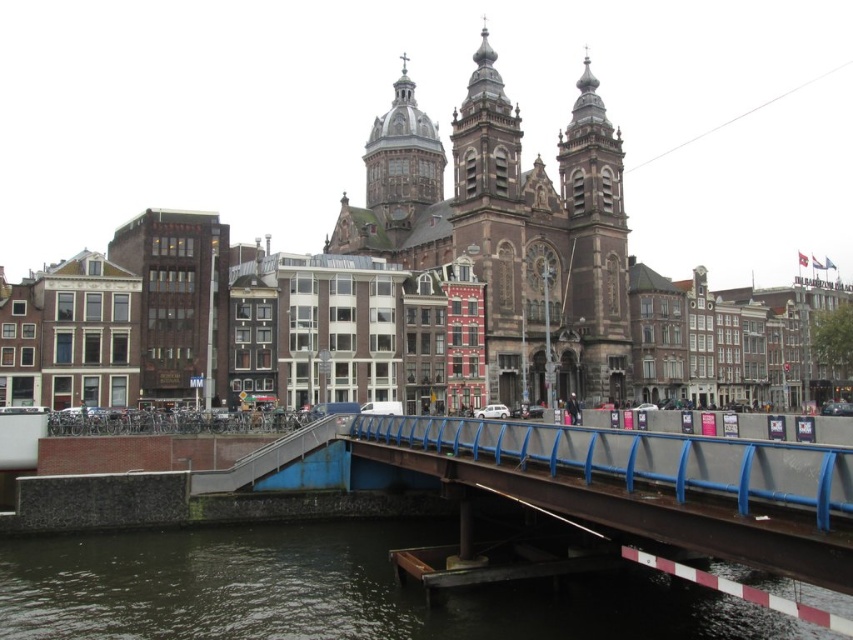
Question: Does brown stone church at center have a larger size compared to blue metallic railing at center?

Choices:
 (A) yes
 (B) no

Answer: (A)

Question: Which object appears closest to the camera in this image?

Choices:
 (A) dark gray water at lower center
 (B) brown stone church at center
 (C) blue metallic railing at center

Answer: (C)

Question: Does dark gray water at lower center have a larger size compared to blue metallic railing at center?

Choices:
 (A) yes
 (B) no

Answer: (B)

Question: Is brown stone church at center in front of blue metallic railing at center?

Choices:
 (A) no
 (B) yes

Answer: (A)

Question: Which point appears closest to the camera in this image?

Choices:
 (A) (601, 349)
 (B) (474, 444)
 (C) (90, 554)

Answer: (B)

Question: Among these objects, which one is farthest from the camera?

Choices:
 (A) dark gray water at lower center
 (B) brown stone church at center
 (C) blue metallic railing at center

Answer: (B)